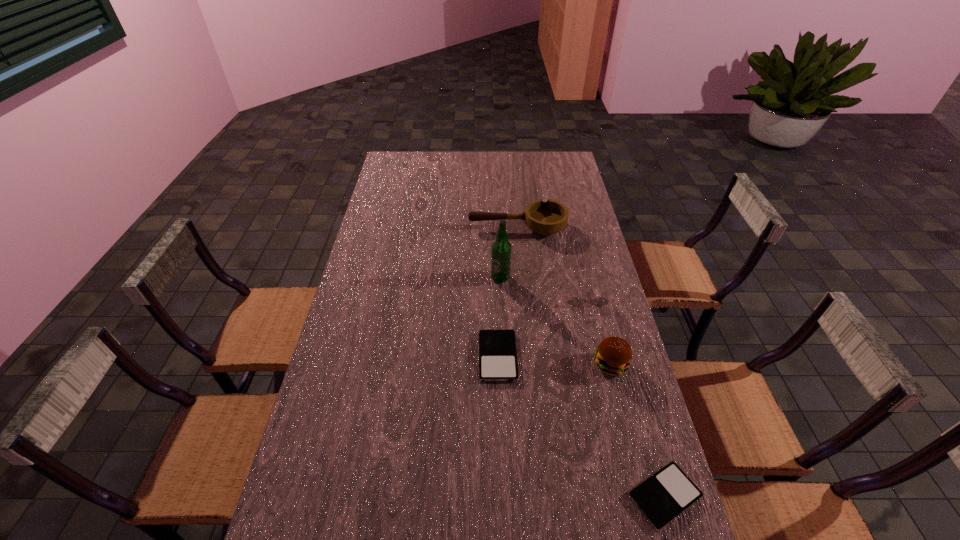
Please point out where to position a new iPod on the left to maintain spacing. Please provide its 2D coordinates. Your answer should be formatted as a tuple, i.e. [(x, y)], where the tuple contains the x and y coordinates of a point satisfying the conditions above.

[(390, 267)]